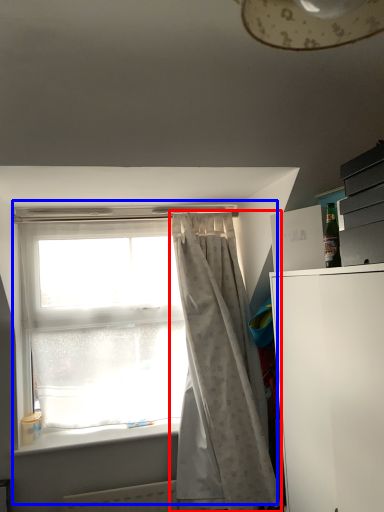
Question: Which object is further to the camera taking this photo, curtain (highlighted by a red box) or window (highlighted by a blue box)?

Choices:
 (A) curtain
 (B) window

Answer: (B)